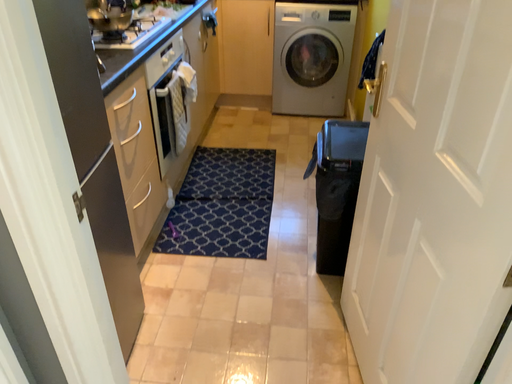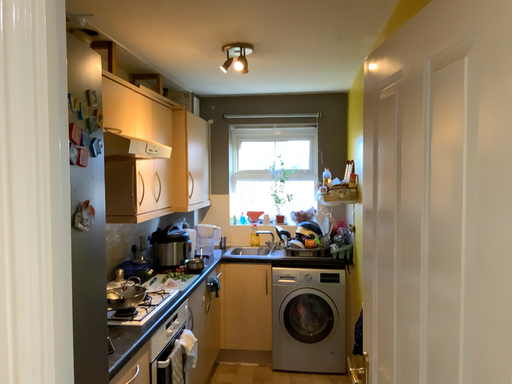
Question: How did the camera likely rotate when shooting the video?

Choices:
 (A) rotated upward
 (B) rotated downward

Answer: (A)